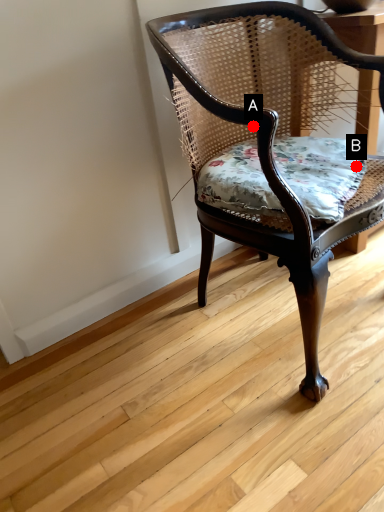
Question: Two points are circled on the image, labeled by A and B beside each circle. Which point is closer to the camera?

Choices:
 (A) A is closer
 (B) B is closer

Answer: (A)